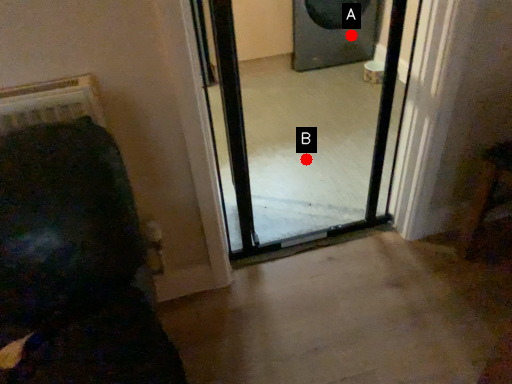
Question: Two points are circled on the image, labeled by A and B beside each circle. Which point appears closest to the camera in this image?

Choices:
 (A) A is closer
 (B) B is closer

Answer: (B)